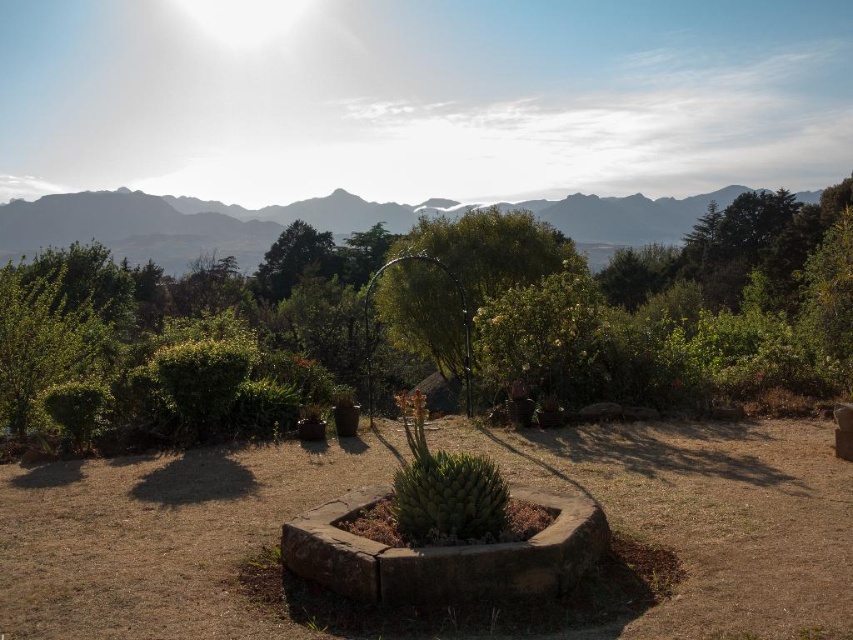
From the picture: You are a landscape architect designing a new garden layout. You need to ensure that the green succulent at center is visible from the main pathway that runs along the lower edge of the garden. Given the presence of the green textured mountain at upper center, will the succulent be obscured by the mountain?

The green textured mountain at upper center is above the green succulent at center, so the succulent will not be obscured by the mountain as it is positioned lower in the scene.

You are a gardener planning to plant a new tree in the garden. You have two options in front of you, the green leafy tree at center and the green succulent at center. Given that the garden has limited space, which of the two would you choose if you want a smaller plant that won?

The green succulent at center is smaller in size than the green leafy tree at center, so you should choose the green succulent at center for the limited space.

You are a landscape architect designing a new garden layout. You need to place a new statue that is 1.2 meters wide between the green textured mountain at upper center and the green succulent at center. Based on their widths, can the statue fit between them without overlapping?

The green textured mountain at upper center might be wider than the green succulent at center, but since the exact width difference isn not specified, it is uncertain if the 1.2 meter wide statue can fit between them without overlapping. More information is needed to determine this.